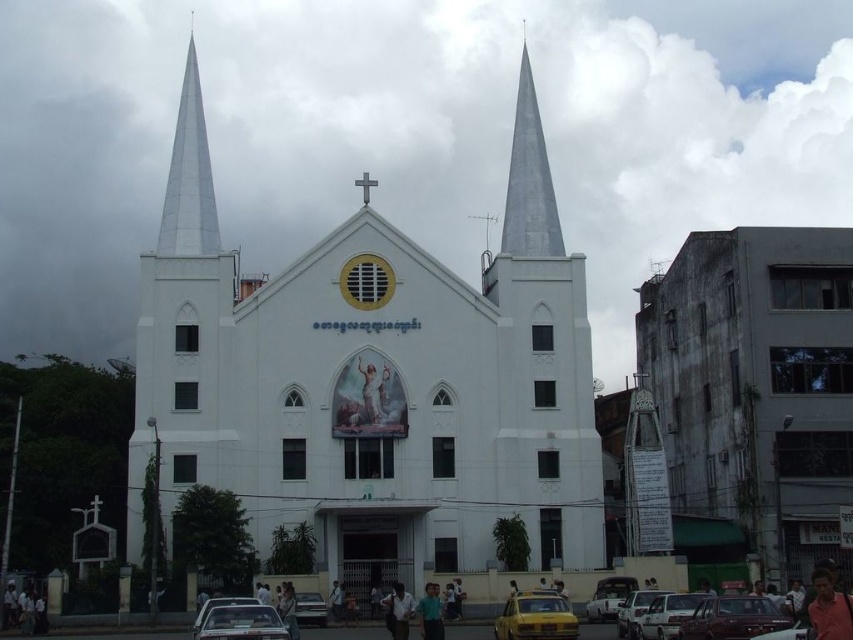
You are a photographer standing in front of the church. You want to take a photo of the silver metallic spire at center and the white matte car at center. Which object will appear higher in your photo?

The silver metallic spire at center will appear higher in the photo because it is positioned above the white matte car at center according to the description.

Looking at this image, you are a photographer standing at the lower left corner of the image. You want to capture a photo that includes both the white smooth church at center and the white matte car at lower right. Which object should you position closer to the edge of the frame to ensure both are fully visible?

The white smooth church at center might be wider than the white matte car at lower right, so you should position the white matte car at lower right closer to the edge to ensure both are fully visible.